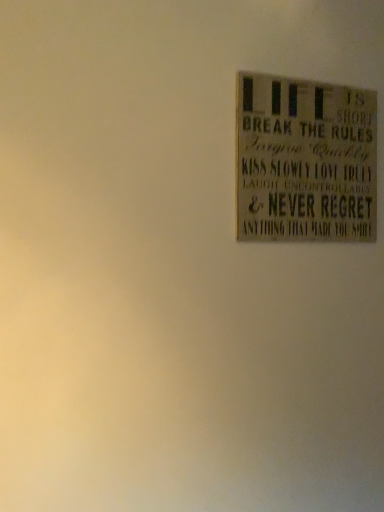
Image resolution: width=384 pixels, height=512 pixels. Describe the element at coordinates (305, 160) in the screenshot. I see `wooden signboard at upper right` at that location.

I want to click on wooden signboard at upper right, so click(305, 160).

The height and width of the screenshot is (512, 384). Identify the location of wooden signboard at upper right. (305, 160).